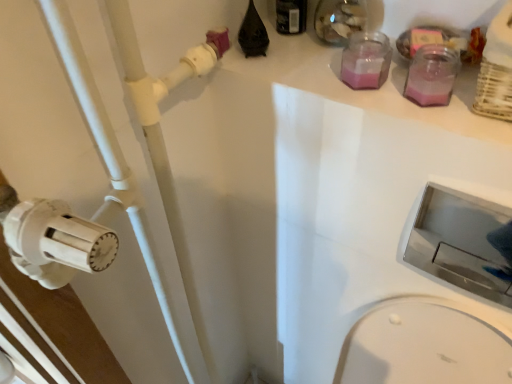
The image size is (512, 384). Find the location of `vacant area that is in front of black plastic bottle at upper center, which is the first bottle in top-to-bottom order`. vacant area that is in front of black plastic bottle at upper center, which is the first bottle in top-to-bottom order is located at coordinates (311, 72).